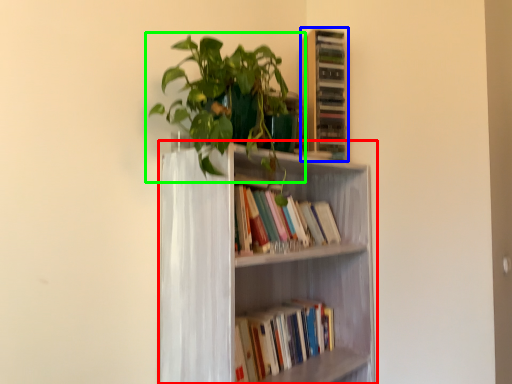
Question: Based on their relative distances, which object is farther from bookcase (highlighted by a red box)? Choose from shelf (highlighted by a blue box) and houseplant (highlighted by a green box).

Choices:
 (A) shelf
 (B) houseplant

Answer: (A)